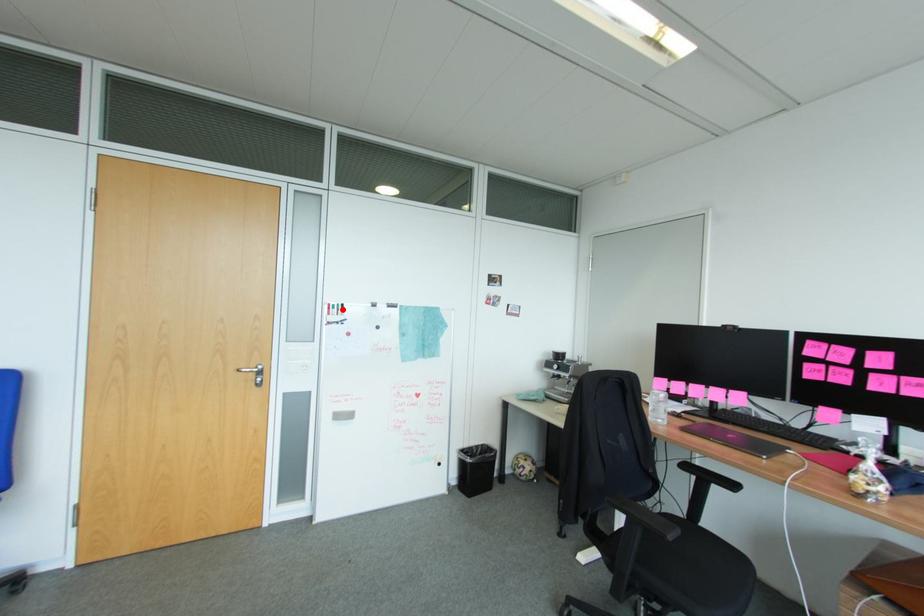
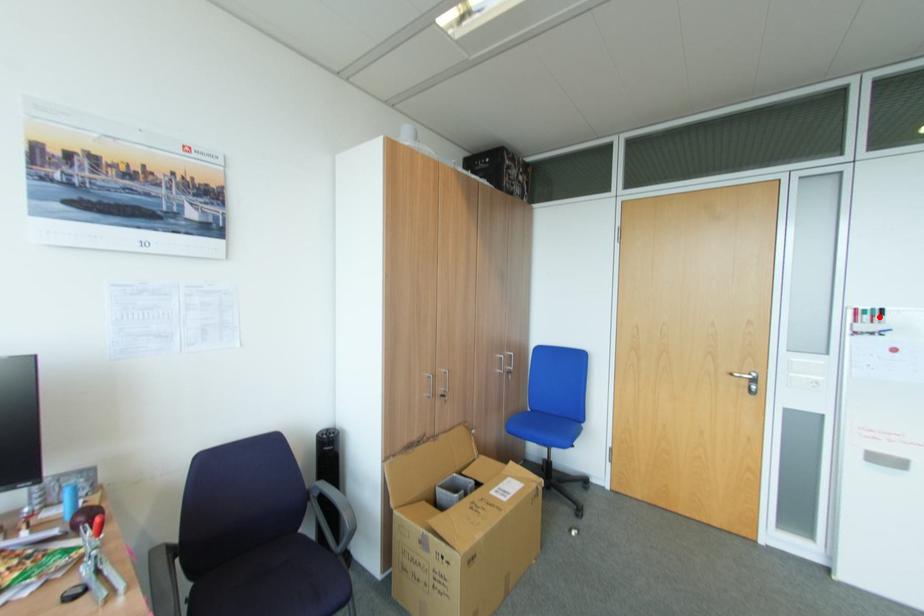
I am providing you with two images of the same scene from different viewpoints. A red point is marked on the first image and another point is marked on the second image. Does the point marked in image1 correspond to the same location as the one in image2?

Yes